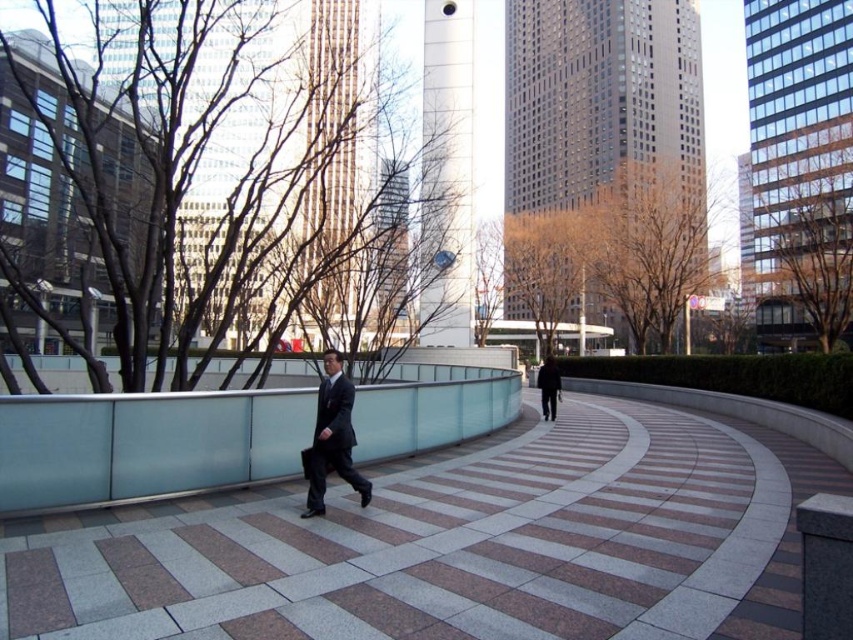
Does dark gray suit at center have a lesser height compared to black matte jacket at center?

Yes.

Does point (358, 493) come behind point (550, 417)?

No.

The image size is (853, 640). What are the coordinates of `dark gray suit at center` in the screenshot? It's located at (332, 436).

Is granite walkway at center shorter than dark gray suit at center?

Yes, granite walkway at center is shorter than dark gray suit at center.

Between granite walkway at center and dark gray suit at center, which one appears on the left side from the viewer's perspective?

dark gray suit at center is more to the left.

Which is behind, point (340, 554) or point (318, 490)?

The point (318, 490) is behind.

I want to click on granite walkway at center, so click(456, 545).

Can you confirm if granite walkway at center is positioned above black matte jacket at center?

Yes.

Which of these two, granite walkway at center or black matte jacket at center, stands taller?

With more height is black matte jacket at center.

The width and height of the screenshot is (853, 640). I want to click on granite walkway at center, so click(x=456, y=545).

The image size is (853, 640). I want to click on granite walkway at center, so click(456, 545).